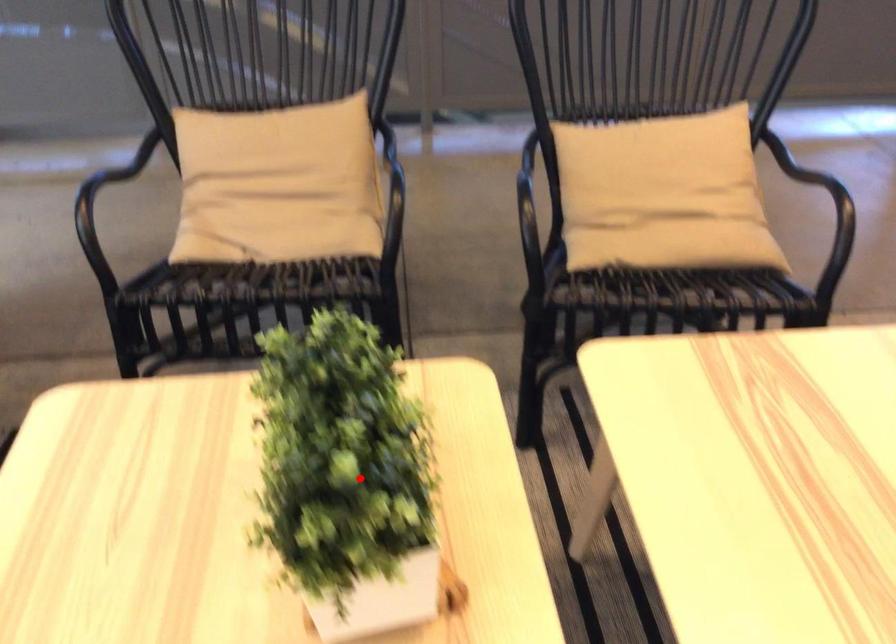
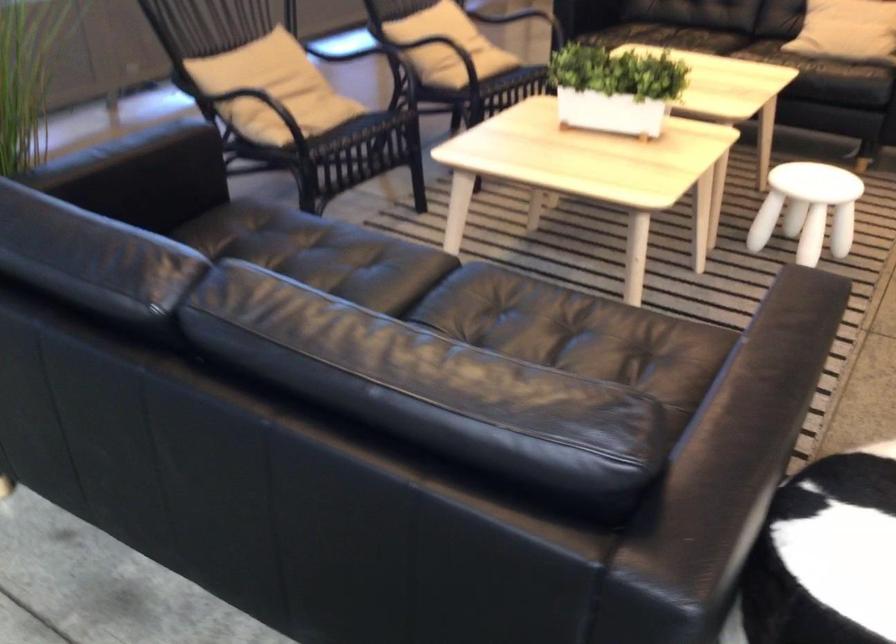
The point at the highlighted location is marked in the first image. Where is the corresponding point in the second image?

(615, 88)